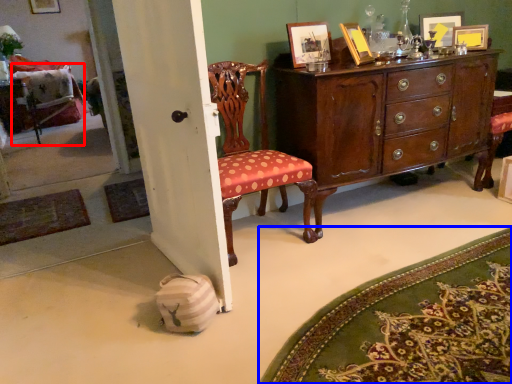
Question: Which point is further to the camera, swivel chair (highlighted by a red box) or mat (highlighted by a blue box)?

Choices:
 (A) swivel chair
 (B) mat

Answer: (A)